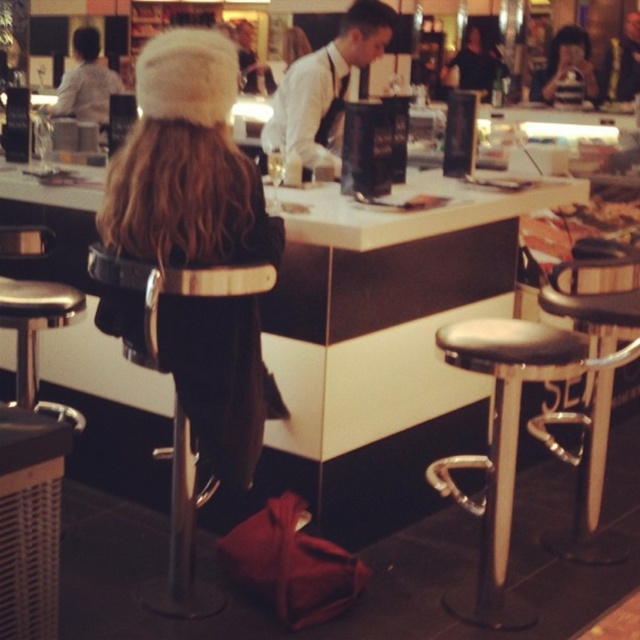
Question: Which object is closer to the camera taking this photo?

Choices:
 (A) white fur hat at upper left
 (B) black leather bar stool at right
 (C) black leather stool at right

Answer: (A)

Question: Is black leather stool at right closer to the viewer compared to white shirt at center?

Choices:
 (A) yes
 (B) no

Answer: (A)

Question: Which object appears farthest from the camera in this image?

Choices:
 (A) black leather bar stool at right
 (B) striped fabric shirt at upper right
 (C) white fur hat at upper left

Answer: (B)

Question: Is white fur hat at upper left to the left of black leather bar stool at right from the viewer's perspective?

Choices:
 (A) no
 (B) yes

Answer: (B)

Question: Is white fur hat at upper left thinner than white shirt at center?

Choices:
 (A) yes
 (B) no

Answer: (A)

Question: Which point is farther to the camera?

Choices:
 (A) (340, 128)
 (B) (596, 310)

Answer: (A)